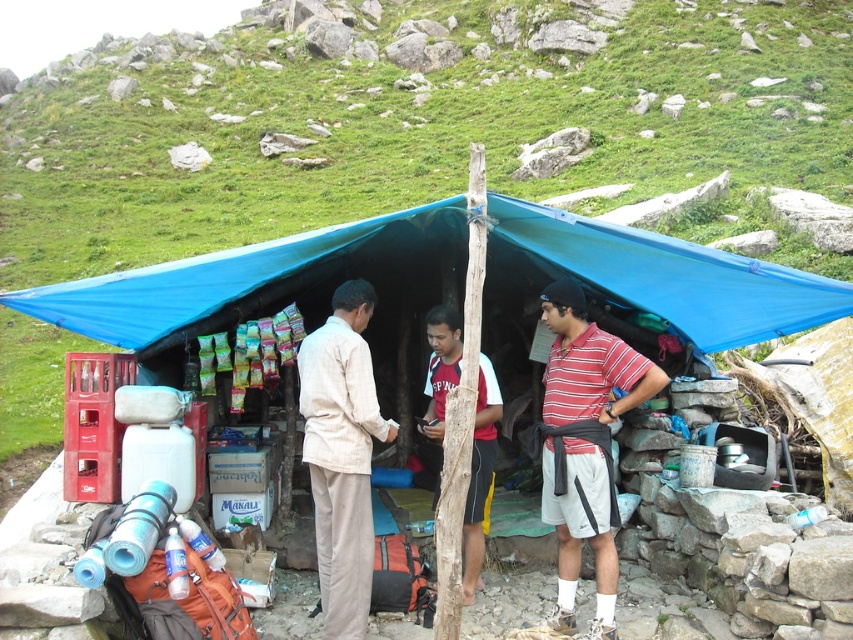
Question: Which point is closer to the camera?

Choices:
 (A) red and white jersey at center
 (B) light beige cotton shirt at center
 (C) striped cotton polo shirt at center

Answer: (C)

Question: Is blue tarp at center bigger than striped cotton polo shirt at center?

Choices:
 (A) no
 (B) yes

Answer: (A)

Question: Which of the following is the closest to the observer?

Choices:
 (A) (160, 330)
 (B) (479, 579)

Answer: (A)

Question: Observing the image, what is the correct spatial positioning of striped cotton polo shirt at center in reference to light beige cotton shirt at center?

Choices:
 (A) left
 (B) right

Answer: (B)

Question: Can you confirm if blue tarp at center is positioned to the right of striped cotton polo shirt at center?

Choices:
 (A) yes
 (B) no

Answer: (A)

Question: Which object appears farthest from the camera in this image?

Choices:
 (A) red and white jersey at center
 (B) blue tarp at center
 (C) striped cotton polo shirt at center

Answer: (A)